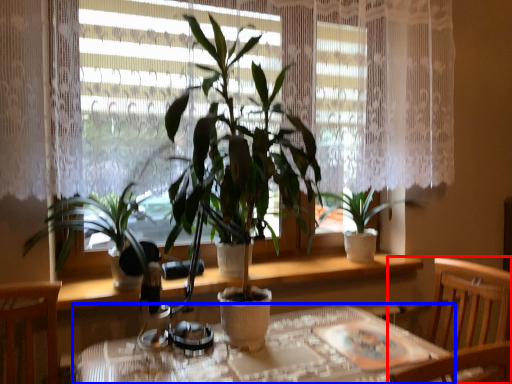
Question: Which object appears closest to the camera in this image, chair (highlighted by a red box) or table (highlighted by a blue box)?

Choices:
 (A) chair
 (B) table

Answer: (B)